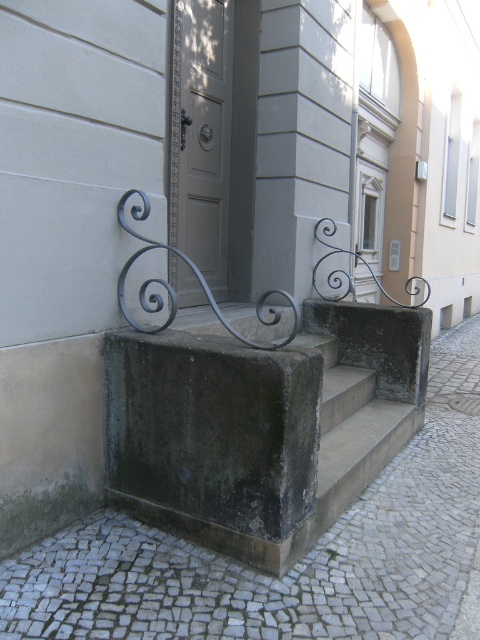
Is gray concrete pavement at lower center positioned behind matte gray door at center?

No.

Consider the image. Can you confirm if gray concrete pavement at lower center is thinner than matte gray door at center?

No.

Who is more distant from viewer, [414,616] or [229,76]?

The point [229,76] is more distant.

Locate an element on the screen. This screenshot has height=640, width=480. gray concrete pavement at lower center is located at coordinates (296, 564).

Where is `gray concrete pavement at lower center`? The image size is (480, 640). gray concrete pavement at lower center is located at coordinates (296, 564).

Is point (1, 625) closer to camera compared to point (259, 308)?

Yes, point (1, 625) is closer to viewer.

Identify the location of gray concrete pavement at lower center. (296, 564).

Is point (195, 193) positioned after point (266, 348)?

Yes, it is behind point (266, 348).

How much distance is there between matte gray door at center and black wrought iron rail at center?

matte gray door at center is 5.98 feet from black wrought iron rail at center.

The height and width of the screenshot is (640, 480). What do you see at coordinates (201, 134) in the screenshot? I see `matte gray door at center` at bounding box center [201, 134].

Locate an element on the screen. This screenshot has width=480, height=640. matte gray door at center is located at coordinates (201, 134).